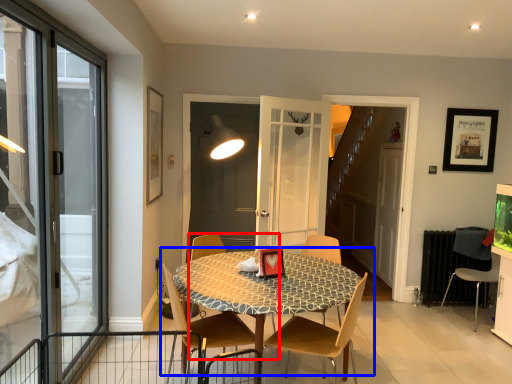
Question: Among these objects, which one is nearest to the camera, chair (highlighted by a red box) or kitchen & dining room table (highlighted by a blue box)?

Choices:
 (A) chair
 (B) kitchen & dining room table

Answer: (B)